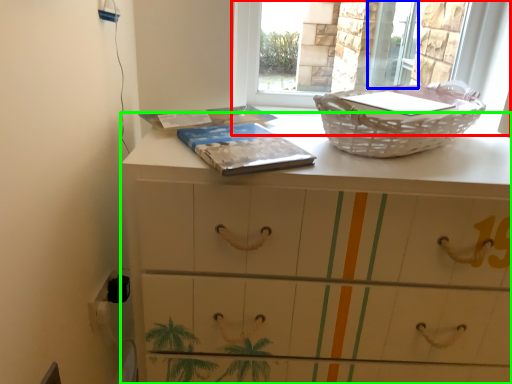
Question: Estimate the real-world distances between objects in this image. Which object is farther from window (highlighted by a red box), screen door (highlighted by a blue box) or chest of drawers (highlighted by a green box)?

Choices:
 (A) screen door
 (B) chest of drawers

Answer: (A)